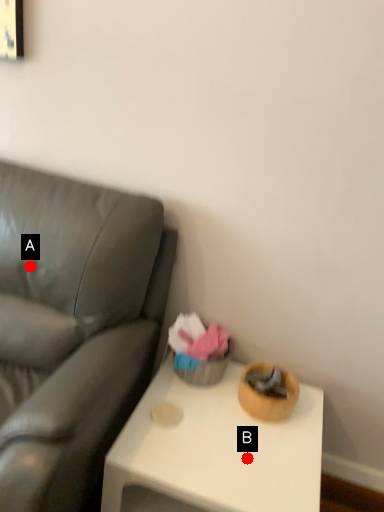
Question: Two points are circled on the image, labeled by A and B beside each circle. Which of the following is the closest to the observer?

Choices:
 (A) A is closer
 (B) B is closer

Answer: (B)